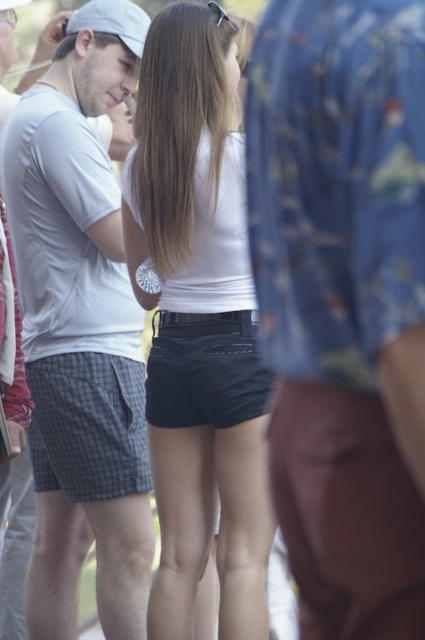
Does floral fabric shirt at center have a larger size compared to white matte baseball cap at upper left?

Correct, floral fabric shirt at center is larger in size than white matte baseball cap at upper left.

Is the position of floral fabric shirt at center more distant than that of white matte baseball cap at upper left?

No, it is in front of white matte baseball cap at upper left.

Locate an element on the screen. floral fabric shirt at center is located at coordinates (340, 298).

Which is below, floral fabric shirt at center or black matte shorts at center?

Positioned lower is black matte shorts at center.

Identify the location of floral fabric shirt at center. (340, 298).

In order to click on floral fabric shirt at center in this screenshot , I will do `click(340, 298)`.

Does point (124, 230) come in front of point (118, 28)?

Yes, it is in front of point (118, 28).

Does black matte shorts at center appear on the right side of white matte baseball cap at upper left?

Indeed, black matte shorts at center is positioned on the right side of white matte baseball cap at upper left.

The image size is (425, 640). Describe the element at coordinates (198, 324) in the screenshot. I see `black matte shorts at center` at that location.

The image size is (425, 640). Identify the location of black matte shorts at center. (198, 324).